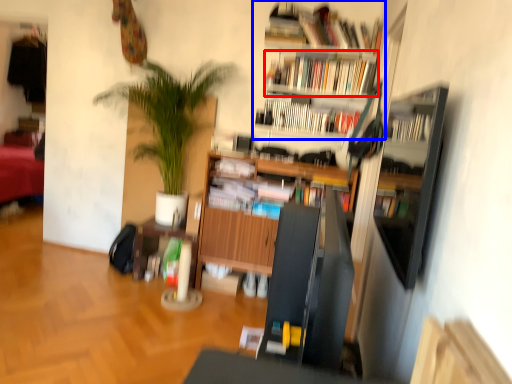
Question: Among these objects, which one is farthest to the camera, book (highlighted by a red box) or bookcase (highlighted by a blue box)?

Choices:
 (A) book
 (B) bookcase

Answer: (A)